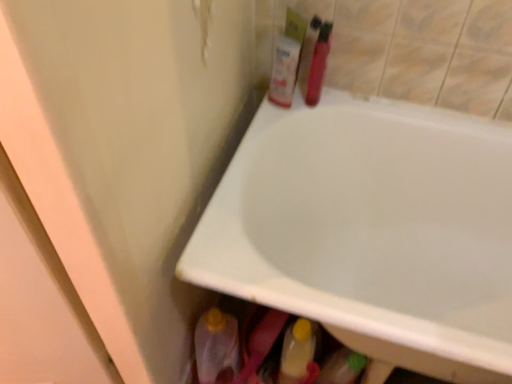
Locate an element on the screen. This screenshot has width=512, height=384. translucent plastic bottle at upper center, which is the 2th toiletry from right to left is located at coordinates point(287,60).

Find the location of a particular element. yellow cap plastic bottle at lower center is located at coordinates (297, 351).

Where is `white glossy bathtub at upper center`? white glossy bathtub at upper center is located at coordinates (371, 230).

The image size is (512, 384). What are the coordinates of `bathtub on the right of shiny plastic bottle at upper right, which ranks as the 1th toiletry in right-to-left order` in the screenshot? It's located at [x=371, y=230].

From a real-world perspective, which is physically below, white glossy bathtub at upper center or shiny plastic bottle at upper right, placed as the second toiletry when sorted from left to right?

In real-world perspective, white glossy bathtub at upper center is lower.

How far apart are white glossy bathtub at upper center and shiny plastic bottle at upper right, placed as the second toiletry when sorted from left to right?

white glossy bathtub at upper center is 17.04 inches away from shiny plastic bottle at upper right, placed as the second toiletry when sorted from left to right.

Considering their positions, is white glossy bathtub at upper center located in front of or behind shiny plastic bottle at upper right, which ranks as the 1th toiletry in right-to-left order?

white glossy bathtub at upper center is positioned closer to the viewer than shiny plastic bottle at upper right, which ranks as the 1th toiletry in right-to-left order.

Considering the relative sizes of yellow cap plastic bottle at lower center and translucent plastic bottle at upper center, positioned as the first toiletry in left-to-right order, in the image provided, is yellow cap plastic bottle at lower center taller than translucent plastic bottle at upper center, positioned as the first toiletry in left-to-right order,?

Yes, yellow cap plastic bottle at lower center is taller than translucent plastic bottle at upper center, positioned as the first toiletry in left-to-right order.

Do you think yellow cap plastic bottle at lower center is within translucent plastic bottle at upper center, which is the 2th toiletry from right to left, or outside of it?

yellow cap plastic bottle at lower center is spatially situated outside translucent plastic bottle at upper center, which is the 2th toiletry from right to left.

From a real-world perspective, is yellow cap plastic bottle at lower center above or below translucent plastic bottle at upper center, positioned as the first toiletry in left-to-right order?

From a real-world perspective, yellow cap plastic bottle at lower center is physically below translucent plastic bottle at upper center, positioned as the first toiletry in left-to-right order.

Can you confirm if yellow cap plastic bottle at lower center is wider than translucent plastic bottle at upper center, positioned as the first toiletry in left-to-right order?

Yes, yellow cap plastic bottle at lower center is wider than translucent plastic bottle at upper center, positioned as the first toiletry in left-to-right order.

How different are the orientations of shiny plastic bottle at upper right, placed as the second toiletry when sorted from left to right, and white glossy bathtub at upper center in degrees?

There is a 92.9-degree angle between the facing directions of shiny plastic bottle at upper right, placed as the second toiletry when sorted from left to right, and white glossy bathtub at upper center.

Is shiny plastic bottle at upper right, which ranks as the 1th toiletry in right-to-left order, located outside white glossy bathtub at upper center?

Yes.

Would you say shiny plastic bottle at upper right, which ranks as the 1th toiletry in right-to-left order, is to the left or to the right of white glossy bathtub at upper center in the picture?

shiny plastic bottle at upper right, which ranks as the 1th toiletry in right-to-left order, is positioned on white glossy bathtub at upper center's left side.

What are the coordinates of `the 1st toiletry above the white glossy bathtub at upper center (from a real-world perspective)` in the screenshot? It's located at (318, 60).

Find the location of `bathtub lying above the yellow cap plastic bottle at lower center (from the image's perspective)`. bathtub lying above the yellow cap plastic bottle at lower center (from the image's perspective) is located at coordinates (371, 230).

Can you confirm if white glossy bathtub at upper center is positioned to the left of yellow cap plastic bottle at lower center?

No, white glossy bathtub at upper center is not to the left of yellow cap plastic bottle at lower center.

Is white glossy bathtub at upper center further to the viewer compared to yellow cap plastic bottle at lower center?

No, white glossy bathtub at upper center is closer to the camera.

Is point (318, 39) positioned in front of point (293, 378)?

Yes, point (318, 39) is closer to viewer.

Is shiny plastic bottle at upper right, which ranks as the 1th toiletry in right-to-left order, with yellow cap plastic bottle at lower center?

They are not placed beside each other.

Is point (305, 345) farther from viewer compared to point (323, 78)?

No, (305, 345) is closer to viewer.

Based on the photo, from a real-world perspective, which is physically below, yellow cap plastic bottle at lower center or shiny plastic bottle at upper right, placed as the second toiletry when sorted from left to right?

yellow cap plastic bottle at lower center.

Does yellow cap plastic bottle at lower center turn towards shiny plastic bottle at upper right, placed as the second toiletry when sorted from left to right?

No, yellow cap plastic bottle at lower center does not turn towards shiny plastic bottle at upper right, placed as the second toiletry when sorted from left to right.

Which object is closer to the camera, yellow cap plastic bottle at lower center or shiny plastic bottle at upper right, placed as the second toiletry when sorted from left to right?

yellow cap plastic bottle at lower center is more forward.

Does translucent plastic bottle at upper center, positioned as the first toiletry in left-to-right order, appear on the left side of shiny plastic bottle at upper right, placed as the second toiletry when sorted from left to right?

Yes.

Would you say shiny plastic bottle at upper right, which ranks as the 1th toiletry in right-to-left order, is part of translucent plastic bottle at upper center, positioned as the first toiletry in left-to-right order,'s contents?

Answer: No, translucent plastic bottle at upper center, positioned as the first toiletry in left-to-right order, does not contain shiny plastic bottle at upper right, which ranks as the 1th toiletry in right-to-left order.

Which toiletry is the 1st one when counting from the back of the white glossy bathtub at upper center? Please provide its 2D coordinates.

[(318, 60)]

You are a GUI agent. You are given a task and a screenshot of the screen. Output one action in this format:
    pyautogui.click(x=<x>, y=<y>)
    Task: Click on the mouthwash directly beneath the translucent plastic bottle at upper center, positioned as the first toiletry in left-to-right order (from a real-world perspective)
    This screenshot has width=512, height=384.
    Given the screenshot: What is the action you would take?
    pyautogui.click(x=297, y=351)

From the image, which object appears to be nearer to white glossy bathtub at upper center, translucent plastic bottle at upper center, positioned as the first toiletry in left-to-right order, or yellow cap plastic bottle at lower center?

Based on the image, yellow cap plastic bottle at lower center appears to be nearer to white glossy bathtub at upper center.

From the image, which object appears to be farther from white glossy bathtub at upper center, shiny plastic bottle at upper right, which ranks as the 1th toiletry in right-to-left order, or yellow cap plastic bottle at lower center?

shiny plastic bottle at upper right, which ranks as the 1th toiletry in right-to-left order, is positioned further to the anchor white glossy bathtub at upper center.

In the scene shown: Which object lies further to the anchor point shiny plastic bottle at upper right, placed as the second toiletry when sorted from left to right, white glossy bathtub at upper center or translucent plastic bottle at upper center, which is the 2th toiletry from right to left?

white glossy bathtub at upper center is positioned further to the anchor shiny plastic bottle at upper right, placed as the second toiletry when sorted from left to right.

Consider the image. Considering their positions, is white glossy bathtub at upper center positioned further to translucent plastic bottle at upper center, which is the 2th toiletry from right to left, than yellow cap plastic bottle at lower center?

yellow cap plastic bottle at lower center is further to translucent plastic bottle at upper center, which is the 2th toiletry from right to left.

Considering their positions, is shiny plastic bottle at upper right, placed as the second toiletry when sorted from left to right, positioned further to white glossy bathtub at upper center than translucent plastic bottle at upper center, which is the 2th toiletry from right to left?

shiny plastic bottle at upper right, placed as the second toiletry when sorted from left to right, is further to white glossy bathtub at upper center.

Looking at the image, which one is located further to white glossy bathtub at upper center, translucent plastic bottle at upper center, positioned as the first toiletry in left-to-right order, or shiny plastic bottle at upper right, which ranks as the 1th toiletry in right-to-left order?

shiny plastic bottle at upper right, which ranks as the 1th toiletry in right-to-left order, lies further to white glossy bathtub at upper center than the other object.

From the image, which object appears to be farther from shiny plastic bottle at upper right, which ranks as the 1th toiletry in right-to-left order, yellow cap plastic bottle at lower center or translucent plastic bottle at upper center, positioned as the first toiletry in left-to-right order?

yellow cap plastic bottle at lower center.

When comparing their distances from yellow cap plastic bottle at lower center, does shiny plastic bottle at upper right, which ranks as the 1th toiletry in right-to-left order, or white glossy bathtub at upper center seem further?

shiny plastic bottle at upper right, which ranks as the 1th toiletry in right-to-left order, is further to yellow cap plastic bottle at lower center.

The image size is (512, 384). I want to click on toiletry between translucent plastic bottle at upper center, which is the 2th toiletry from right to left, and white glossy bathtub at upper center in the up-down direction, so click(x=318, y=60).

Where is `bathtub between shiny plastic bottle at upper right, which ranks as the 1th toiletry in right-to-left order, and yellow cap plastic bottle at lower center, in the vertical direction`? This screenshot has height=384, width=512. bathtub between shiny plastic bottle at upper right, which ranks as the 1th toiletry in right-to-left order, and yellow cap plastic bottle at lower center, in the vertical direction is located at coordinates tap(371, 230).

Identify the location of bathtub that lies between translucent plastic bottle at upper center, positioned as the first toiletry in left-to-right order, and yellow cap plastic bottle at lower center from top to bottom. This screenshot has height=384, width=512. (371, 230).

I want to click on toiletry between translucent plastic bottle at upper center, which is the 2th toiletry from right to left, and yellow cap plastic bottle at lower center in the up-down direction, so click(318, 60).